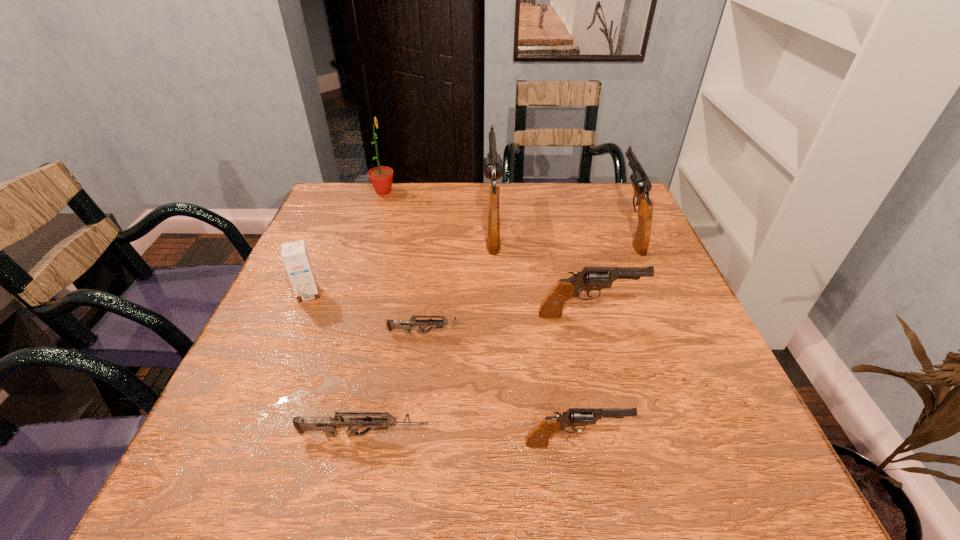
Locate an element on the screen. This screenshot has width=960, height=540. sunflower is located at coordinates (381, 178).

Where is `the third gun from left to right`? The width and height of the screenshot is (960, 540). the third gun from left to right is located at coordinates (493, 168).

Image resolution: width=960 pixels, height=540 pixels. I want to click on the biggest black gun, so click(x=493, y=168).

This screenshot has width=960, height=540. What are the coordinates of `the fifth shortest gun` in the screenshot? It's located at (641, 184).

The width and height of the screenshot is (960, 540). Identify the location of the rightmost gun. (641, 184).

Locate an element on the screen. The image size is (960, 540). the leftmost object is located at coordinates (294, 254).

Image resolution: width=960 pixels, height=540 pixels. Find the location of `chocolate milk`. chocolate milk is located at coordinates (294, 254).

The image size is (960, 540). Identify the location of the fourth shortest gun. (590, 278).

You are a GUI agent. You are given a task and a screenshot of the screen. Output one action in this format:
    pyautogui.click(x=<x>, y=<y>)
    Task: Click on the fifth farthest object
    The image size is (960, 540).
    Given the screenshot: What is the action you would take?
    pyautogui.click(x=590, y=278)

I want to click on the nearest black gun, so click(x=538, y=438).